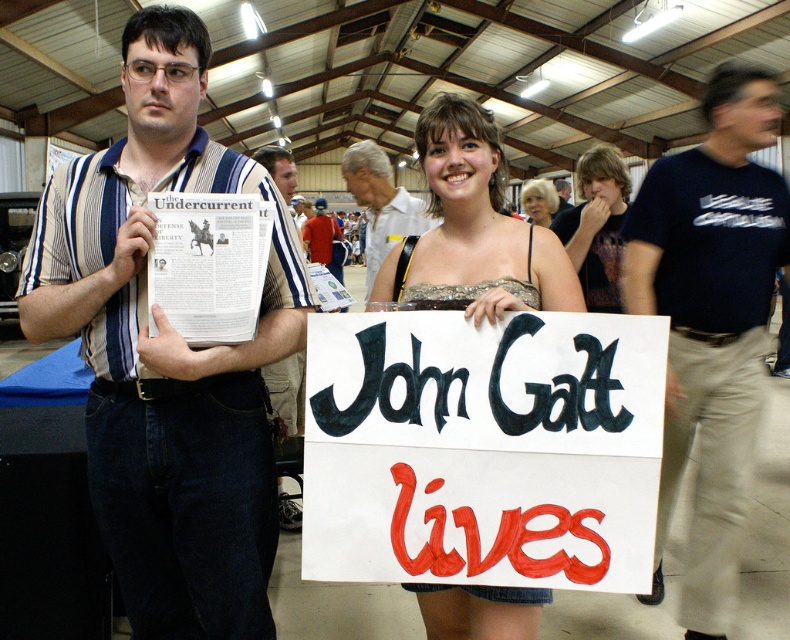
You are a photographer trying to capture a clear shot of the white paper sign at center and the white shirt at center. Which object should you focus on first to ensure it appears sharp in the photo?

You should focus on the white paper sign at center first because it is closer to the viewer than the white shirt at center, so adjusting focus starting from the closer object ensures both can be in focus.

You are a photographer at this event and want to capture both the matte gold dress at center and the striped fabric shirt at left in a single frame. Based on their positions, which one should you focus on first to ensure both are in the shot?

The matte gold dress at center is positioned on the right side of striped fabric shirt at left, so you should focus on the striped fabric shirt at left first to ensure both are included in the frame.

You are a photographer at this event and need to position two models for a quick portrait. The models have smooth brown hair at center and smooth blonde hair at center. Based on their current positions, which model with hair color should be placed lower in the frame to maintain their relative positions?

The smooth brown hair at center should be placed lower in the frame since it is currently below the smooth blonde hair at center.